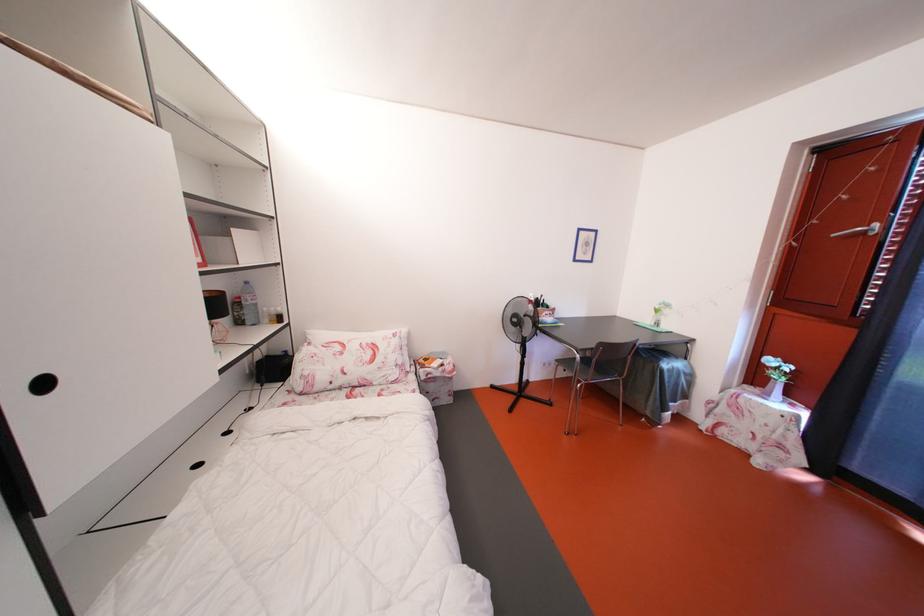
Image resolution: width=924 pixels, height=616 pixels. Find the location of `white flower vase`. white flower vase is located at coordinates (775, 377).